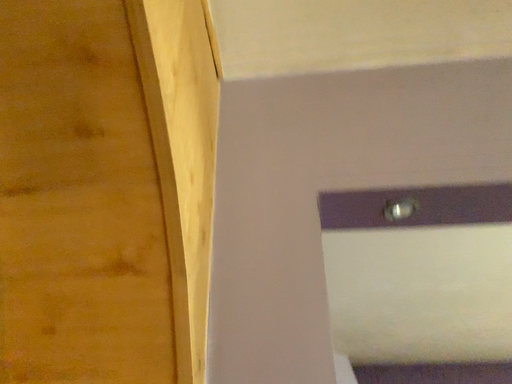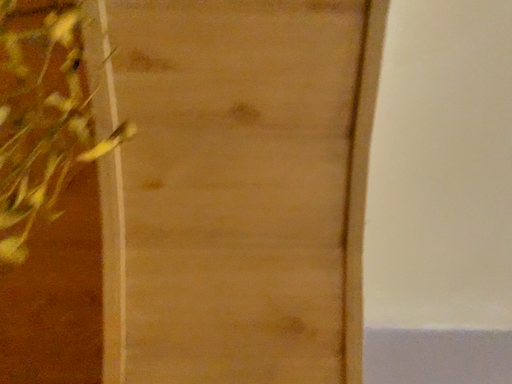
Question: Which way did the camera rotate in the video?

Choices:
 (A) rotated right
 (B) rotated left

Answer: (A)